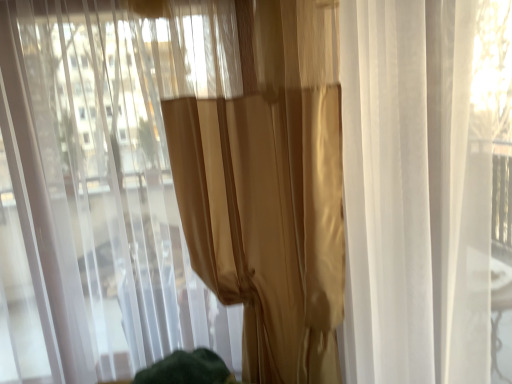
Question: Considering the relative positions of satin gold curtain at center, acting as the second curtain starting from the left, and satin gold curtain at center, marked as the second curtain in a right-to-left arrangement, in the image provided, is satin gold curtain at center, acting as the second curtain starting from the left, in front of satin gold curtain at center, marked as the second curtain in a right-to-left arrangement,?

Choices:
 (A) no
 (B) yes

Answer: (A)

Question: Is satin gold curtain at center, acting as the second curtain starting from the left, next to satin gold curtain at center, marked as the second curtain in a right-to-left arrangement, and touching it?

Choices:
 (A) yes
 (B) no

Answer: (B)

Question: Is satin gold curtain at center, acting as the second curtain starting from the left, to the right of satin gold curtain at center, marked as the second curtain in a right-to-left arrangement, from the viewer's perspective?

Choices:
 (A) yes
 (B) no

Answer: (A)

Question: Would you consider satin gold curtain at center, which is the 1th curtain from right to left, to be distant from satin gold curtain at center, the first curtain in the left-to-right sequence?

Choices:
 (A) no
 (B) yes

Answer: (A)

Question: Does satin gold curtain at center, acting as the second curtain starting from the left, turn towards satin gold curtain at center, marked as the second curtain in a right-to-left arrangement?

Choices:
 (A) yes
 (B) no

Answer: (A)

Question: Is satin gold curtain at center, which is the 1th curtain from right to left, at the left side of satin gold curtain at center, marked as the second curtain in a right-to-left arrangement?

Choices:
 (A) no
 (B) yes

Answer: (A)

Question: Is satin gold curtain at center, the first curtain in the left-to-right sequence, wider than satin gold curtain at center, which is the 1th curtain from right to left?

Choices:
 (A) yes
 (B) no

Answer: (A)

Question: Can you confirm if satin gold curtain at center, marked as the second curtain in a right-to-left arrangement, is thinner than satin gold curtain at center, which is the 1th curtain from right to left?

Choices:
 (A) no
 (B) yes

Answer: (A)

Question: Does satin gold curtain at center, the first curtain in the left-to-right sequence, have a larger size compared to satin gold curtain at center, which is the 1th curtain from right to left?

Choices:
 (A) yes
 (B) no

Answer: (A)

Question: From the image's perspective, is satin gold curtain at center, the first curtain in the left-to-right sequence, over satin gold curtain at center, acting as the second curtain starting from the left?

Choices:
 (A) yes
 (B) no

Answer: (B)

Question: Are satin gold curtain at center, marked as the second curtain in a right-to-left arrangement, and satin gold curtain at center, acting as the second curtain starting from the left, making contact?

Choices:
 (A) yes
 (B) no

Answer: (B)

Question: Does satin gold curtain at center, marked as the second curtain in a right-to-left arrangement, appear on the right side of satin gold curtain at center, which is the 1th curtain from right to left?

Choices:
 (A) yes
 (B) no

Answer: (B)

Question: Is satin gold curtain at center, acting as the second curtain starting from the left, wider or thinner than satin gold curtain at center, marked as the second curtain in a right-to-left arrangement?

Choices:
 (A) thin
 (B) wide

Answer: (A)